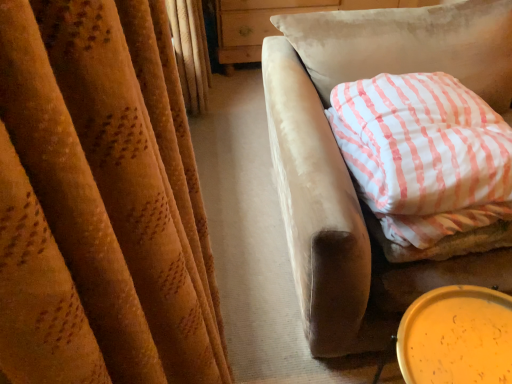
The image size is (512, 384). I want to click on yellow plastic lid at lower right, so click(x=457, y=337).

This screenshot has width=512, height=384. Describe the element at coordinates (457, 337) in the screenshot. I see `yellow plastic lid at lower right` at that location.

What do you see at coordinates (421, 143) in the screenshot? I see `white striped fabric pillow at right` at bounding box center [421, 143].

This screenshot has width=512, height=384. What are the coordinates of `white striped fabric pillow at right` in the screenshot? It's located at (421, 143).

At what (x,y) coordinates should I click in order to perform the action: click on yellow plastic lid at lower right. Please return your answer as a coordinate pair (x, y). The image size is (512, 384). Looking at the image, I should click on (457, 337).

Considering the relative positions of yellow plastic lid at lower right and white striped fabric pillow at right in the image provided, is yellow plastic lid at lower right to the right of white striped fabric pillow at right from the viewer's perspective?

Incorrect, yellow plastic lid at lower right is not on the right side of white striped fabric pillow at right.

Which is behind, yellow plastic lid at lower right or white striped fabric pillow at right?

Positioned behind is white striped fabric pillow at right.

Is point (462, 316) behind point (400, 123)?

No.

From the image's perspective, between yellow plastic lid at lower right and white striped fabric pillow at right, who is located below?

yellow plastic lid at lower right.

From a real-world perspective, which object rests below the other?

From a 3D spatial view, yellow plastic lid at lower right is below.

Is yellow plastic lid at lower right wider than white striped fabric pillow at right?

No.

Considering the relative sizes of yellow plastic lid at lower right and white striped fabric pillow at right in the image provided, is yellow plastic lid at lower right shorter than white striped fabric pillow at right?

No, yellow plastic lid at lower right is not shorter than white striped fabric pillow at right.

Is yellow plastic lid at lower right smaller than white striped fabric pillow at right?

Yes.

Choose the correct answer: Is yellow plastic lid at lower right inside white striped fabric pillow at right or outside it?

yellow plastic lid at lower right is outside white striped fabric pillow at right.

Is yellow plastic lid at lower right not near white striped fabric pillow at right?

yellow plastic lid at lower right is actually quite close to white striped fabric pillow at right.

Is yellow plastic lid at lower right oriented towards white striped fabric pillow at right?

No, yellow plastic lid at lower right does not turn towards white striped fabric pillow at right.

What's the angular difference between yellow plastic lid at lower right and white striped fabric pillow at right's facing directions?

They differ by 92.3 degrees in their facing directions.

You are a GUI agent. You are given a task and a screenshot of the screen. Output one action in this format:
    pyautogui.click(x=<x>, y=<y>)
    Task: Click on the pillow above the yellow plastic lid at lower right (from a real-world perspective)
    
    Given the screenshot: What is the action you would take?
    pyautogui.click(x=421, y=143)

Considering the positions of objects white striped fabric pillow at right and yellow plastic lid at lower right in the image provided, who is more to the right, white striped fabric pillow at right or yellow plastic lid at lower right?

white striped fabric pillow at right.

Is white striped fabric pillow at right positioned in front of yellow plastic lid at lower right?

No, it is not.

Which is less distant, (337,113) or (453,292)?

Positioned in front is point (453,292).

From the image's perspective, is white striped fabric pillow at right beneath yellow plastic lid at lower right?

No, from the image's perspective, white striped fabric pillow at right is not beneath yellow plastic lid at lower right.

From a real-world perspective, does white striped fabric pillow at right sit lower than yellow plastic lid at lower right?

Actually, white striped fabric pillow at right is physically above yellow plastic lid at lower right in the real world.

Is white striped fabric pillow at right wider or thinner than yellow plastic lid at lower right?

Considering their sizes, white striped fabric pillow at right looks broader than yellow plastic lid at lower right.

Considering the relative sizes of white striped fabric pillow at right and yellow plastic lid at lower right in the image provided, is white striped fabric pillow at right shorter than yellow plastic lid at lower right?

Yes.

Can you confirm if white striped fabric pillow at right is bigger than yellow plastic lid at lower right?

Correct, white striped fabric pillow at right is larger in size than yellow plastic lid at lower right.

Which is correct: white striped fabric pillow at right is inside yellow plastic lid at lower right, or outside of it?

white striped fabric pillow at right is outside yellow plastic lid at lower right.

In the scene shown: Is white striped fabric pillow at right beside yellow plastic lid at lower right?

white striped fabric pillow at right and yellow plastic lid at lower right are not in contact.

Could you tell me if white striped fabric pillow at right is turned towards yellow plastic lid at lower right?

No, white striped fabric pillow at right is not aimed at yellow plastic lid at lower right.

Can you tell me how much white striped fabric pillow at right and yellow plastic lid at lower right differ in facing direction?

The angular difference between white striped fabric pillow at right and yellow plastic lid at lower right is 92.3 degrees.

Locate an element on the screen. The height and width of the screenshot is (384, 512). pillow above the yellow plastic lid at lower right (from a real-world perspective) is located at coordinates (421, 143).

Where is `pillow above the yellow plastic lid at lower right (from a real-world perspective)`? pillow above the yellow plastic lid at lower right (from a real-world perspective) is located at coordinates (421, 143).

In the image, there is a white striped fabric pillow at right. What are the coordinates of `beverage below it (from a real-world perspective)` in the screenshot? It's located at (457, 337).